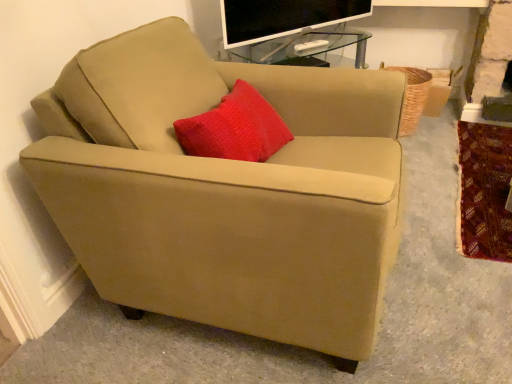
Question: Can you confirm if velvet-like red blanket at lower right is wider than woven brown basket at right?

Choices:
 (A) yes
 (B) no

Answer: (A)

Question: From a real-world perspective, is velvet-like red blanket at lower right physically above woven brown basket at right?

Choices:
 (A) no
 (B) yes

Answer: (A)

Question: Is velvet-like red blanket at lower right at the left side of woven brown basket at right?

Choices:
 (A) yes
 (B) no

Answer: (B)

Question: Considering the relative sizes of velvet-like red blanket at lower right and woven brown basket at right in the image provided, is velvet-like red blanket at lower right shorter than woven brown basket at right?

Choices:
 (A) no
 (B) yes

Answer: (B)

Question: From the image's perspective, would you say velvet-like red blanket at lower right is positioned over woven brown basket at right?

Choices:
 (A) yes
 (B) no

Answer: (B)

Question: Is flat-screen tv at upper center spatially inside velvet-like red blanket at lower right, or outside of it?

Choices:
 (A) inside
 (B) outside

Answer: (B)

Question: Visually, is flat-screen tv at upper center positioned to the left or to the right of velvet-like red blanket at lower right?

Choices:
 (A) left
 (B) right

Answer: (A)

Question: Considering the positions of flat-screen tv at upper center and velvet-like red blanket at lower right in the image, is flat-screen tv at upper center bigger or smaller than velvet-like red blanket at lower right?

Choices:
 (A) big
 (B) small

Answer: (A)

Question: From the image's perspective, is flat-screen tv at upper center positioned above or below velvet-like red blanket at lower right?

Choices:
 (A) above
 (B) below

Answer: (A)

Question: Does point tap(408, 99) appear closer or farther from the camera than point tap(330, 18)?

Choices:
 (A) farther
 (B) closer

Answer: (A)

Question: Looking at their shapes, would you say woven brown basket at right is wider or thinner than flat-screen tv at upper center?

Choices:
 (A) thin
 (B) wide

Answer: (B)

Question: Is woven brown basket at right situated inside flat-screen tv at upper center or outside?

Choices:
 (A) outside
 (B) inside

Answer: (A)

Question: Considering the positions of woven brown basket at right and flat-screen tv at upper center in the image, is woven brown basket at right taller or shorter than flat-screen tv at upper center?

Choices:
 (A) tall
 (B) short

Answer: (A)

Question: Considering the positions of point (303, 16) and point (373, 183), is point (303, 16) closer or farther from the camera than point (373, 183)?

Choices:
 (A) closer
 (B) farther

Answer: (B)

Question: Relative to suede beige armchair at center, is flat-screen tv at upper center in front or behind?

Choices:
 (A) behind
 (B) front

Answer: (A)